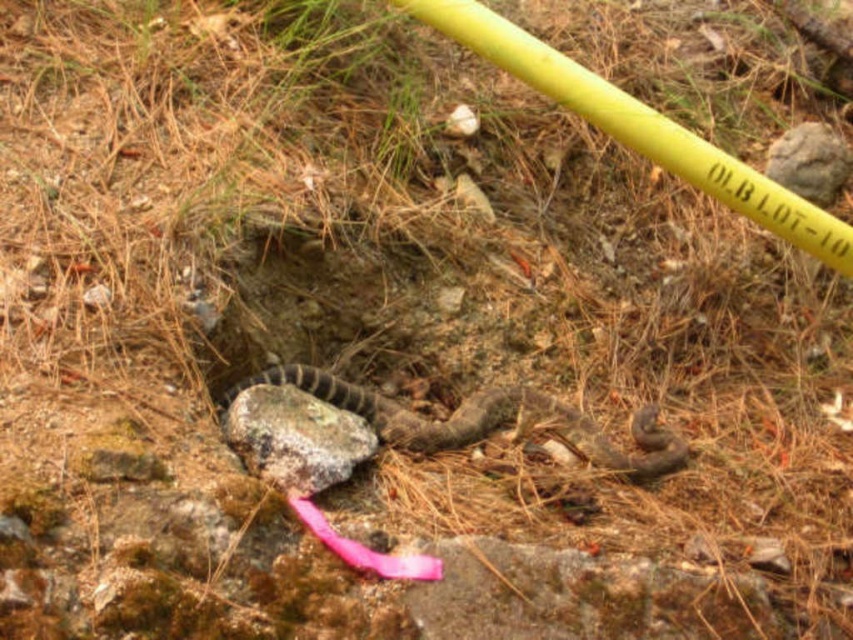
You are a geologist examining the gray rough rock at center and the gray rough rock at upper right in the forest. Which one would you estimate to be bigger?

The gray rough rock at center is larger in size compared to the gray rough rock at upper right.

You are navigating through a forest and come across a gray rough rock at center. Can you determine its exact coordinates in the image?

The gray rough rock at center is located at point (294, 436).

You are standing in a forest and see two points marked in the image. The first point is at coordinates point (x=294, y=419) and the second is at point (x=780, y=144). Which point is closer to you?

Point (x=294, y=419) is closer to the camera than point (x=780, y=144), so the first point is closer to you.